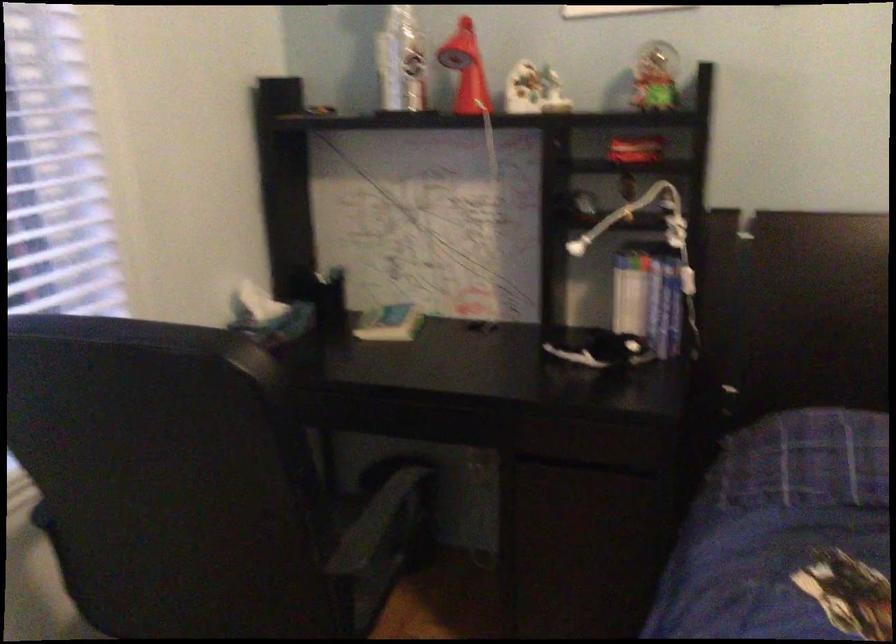
Describe the element at coordinates (576, 247) in the screenshot. I see `the white lamp head` at that location.